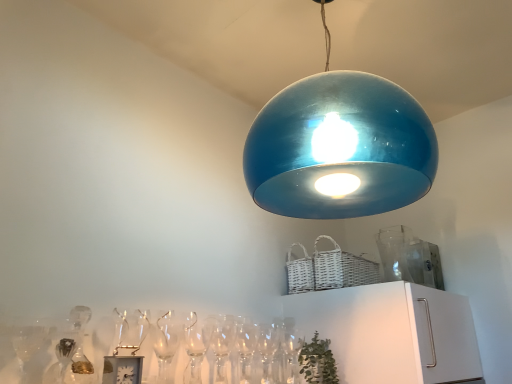
Question: Is glossy blue dome at upper center located outside white wicker basket at upper right?

Choices:
 (A) yes
 (B) no

Answer: (A)

Question: From the image's perspective, is glossy blue dome at upper center located beneath white wicker basket at upper right?

Choices:
 (A) yes
 (B) no

Answer: (B)

Question: Is glossy blue dome at upper center oriented towards white wicker basket at upper right?

Choices:
 (A) yes
 (B) no

Answer: (B)

Question: Does glossy blue dome at upper center come behind white wicker basket at upper right?

Choices:
 (A) yes
 (B) no

Answer: (B)

Question: Can you confirm if glossy blue dome at upper center is wider than white wicker basket at upper right?

Choices:
 (A) yes
 (B) no

Answer: (A)

Question: From a real-world perspective, is glossy blue dome at upper center beneath white wicker basket at upper right?

Choices:
 (A) yes
 (B) no

Answer: (B)

Question: From the image's perspective, is clear glass wine glass at lower center located beneath glossy blue dome at upper center?

Choices:
 (A) no
 (B) yes

Answer: (B)

Question: Is the depth of clear glass wine glass at lower center less than that of glossy blue dome at upper center?

Choices:
 (A) yes
 (B) no

Answer: (B)

Question: Would you say clear glass wine glass at lower center contains glossy blue dome at upper center?

Choices:
 (A) yes
 (B) no

Answer: (B)

Question: Considering the relative sizes of clear glass wine glass at lower center and glossy blue dome at upper center in the image provided, is clear glass wine glass at lower center bigger than glossy blue dome at upper center?

Choices:
 (A) no
 (B) yes

Answer: (A)

Question: Is clear glass wine glass at lower center outside of glossy blue dome at upper center?

Choices:
 (A) no
 (B) yes

Answer: (B)

Question: Is clear glass wine glass at lower center facing towards glossy blue dome at upper center?

Choices:
 (A) yes
 (B) no

Answer: (B)

Question: Can you confirm if white wicker basket at upper right is smaller than glossy blue dome at upper center?

Choices:
 (A) no
 (B) yes

Answer: (B)